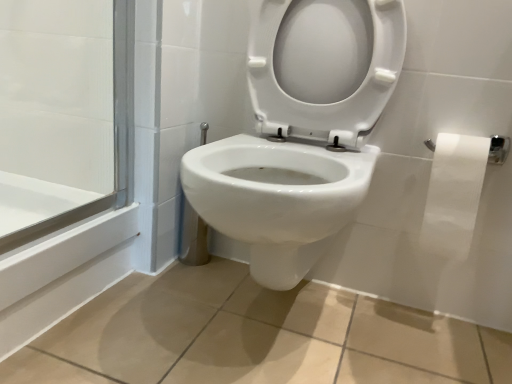
Question: From a real-world perspective, relative to white paper at right, is white glossy toilet at center vertically above or below?

Choices:
 (A) above
 (B) below

Answer: (A)

Question: Is point (306, 263) closer or farther from the camera than point (456, 158)?

Choices:
 (A) farther
 (B) closer

Answer: (A)

Question: Based on their sizes in the image, would you say white glossy toilet at center is bigger or smaller than white paper at right?

Choices:
 (A) small
 (B) big

Answer: (B)

Question: In terms of size, does white paper at right appear bigger or smaller than white glossy toilet at center?

Choices:
 (A) big
 (B) small

Answer: (B)

Question: Do you think white paper at right is within white glossy toilet at center, or outside of it?

Choices:
 (A) inside
 (B) outside

Answer: (B)

Question: Considering their positions, is white paper at right located in front of or behind white glossy toilet at center?

Choices:
 (A) behind
 (B) front

Answer: (A)

Question: From the image's perspective, is white paper at right above or below white glossy toilet at center?

Choices:
 (A) below
 (B) above

Answer: (A)